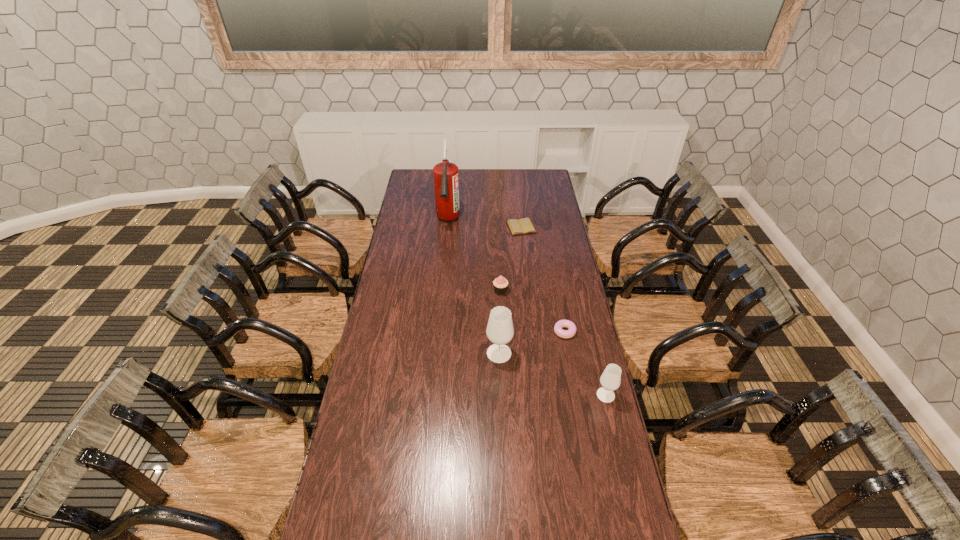
Where is `doughnut`? Image resolution: width=960 pixels, height=540 pixels. doughnut is located at coordinates (560, 324).

Where is `the fifth object from left to right`? The height and width of the screenshot is (540, 960). the fifth object from left to right is located at coordinates (560, 324).

Locate an element on the screen. This screenshot has width=960, height=540. free space located on the back of the left glass is located at coordinates (497, 316).

You are a GUI agent. You are given a task and a screenshot of the screen. Output one action in this format:
    pyautogui.click(x=<x>, y=<y>)
    Task: Click on the vacant space situated 0.310m on the left of the nearer glass
    The height and width of the screenshot is (540, 960).
    Given the screenshot: What is the action you would take?
    pyautogui.click(x=511, y=395)

What are the coordinates of `blank space located 0.250m at the nozzle of the fire extinguisher` in the screenshot? It's located at (444, 270).

Locate an element on the screen. The height and width of the screenshot is (540, 960). free location located 0.240m on the right of the third shortest object is located at coordinates (562, 291).

At what (x,y) coordinates should I click in order to perform the action: click on vacant point located 0.130m on the right of the third object from right to left. Please return your answer as a coordinate pair (x, y). Image resolution: width=960 pixels, height=540 pixels. Looking at the image, I should click on [x=561, y=227].

Where is `vacant region located 0.280m on the left of the third nearest object`? vacant region located 0.280m on the left of the third nearest object is located at coordinates (486, 332).

Locate an element on the screen. glass situated at the right edge is located at coordinates (610, 380).

Locate an element on the screen. The width and height of the screenshot is (960, 540). diary that is at the right edge is located at coordinates (523, 226).